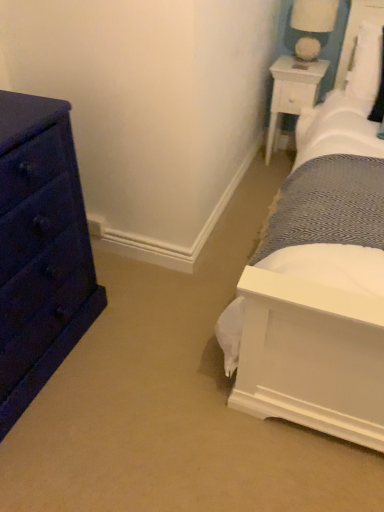
Identify the location of vacant space underneath white fabric-covered lampshade at upper right (from a real-world perspective). This screenshot has height=512, width=384. pos(306,62).